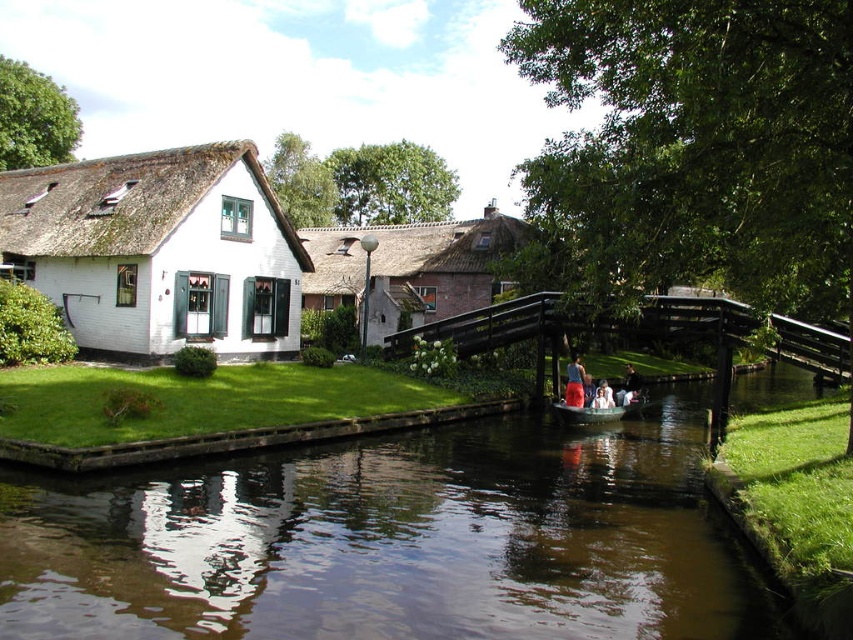
Looking at this image, who is positioned more to the right, white thatched roof cottage at left or thatched roof cottage at center?

thatched roof cottage at center is more to the right.

Is point (48, 276) positioned in front of point (358, 260)?

That is True.

Is point (79, 211) positioned after point (488, 280)?

No, (79, 211) is closer to viewer.

Where is `white thatched roof cottage at left`? white thatched roof cottage at left is located at coordinates (160, 252).

Who is lower down, brown wooden bridge at center or matte blue shorts at lower center?

matte blue shorts at lower center is lower down.

Is brown wooden bridge at center smaller than matte blue shorts at lower center?

No.

Is point (733, 304) behind point (572, 365)?

No, it is not.

This screenshot has height=640, width=853. Find the location of `brown wooden bridge at center`. brown wooden bridge at center is located at coordinates (633, 326).

How distant is brown wooden bridge at center from wooden boat at center?

brown wooden bridge at center is 4.99 meters from wooden boat at center.

Based on the photo, is brown wooden bridge at center thinner than wooden boat at center?

No, brown wooden bridge at center is not thinner than wooden boat at center.

Between point (686, 300) and point (593, 403), which one is positioned behind?

Point (593, 403)

Image resolution: width=853 pixels, height=640 pixels. I want to click on brown wooden bridge at center, so click(633, 326).